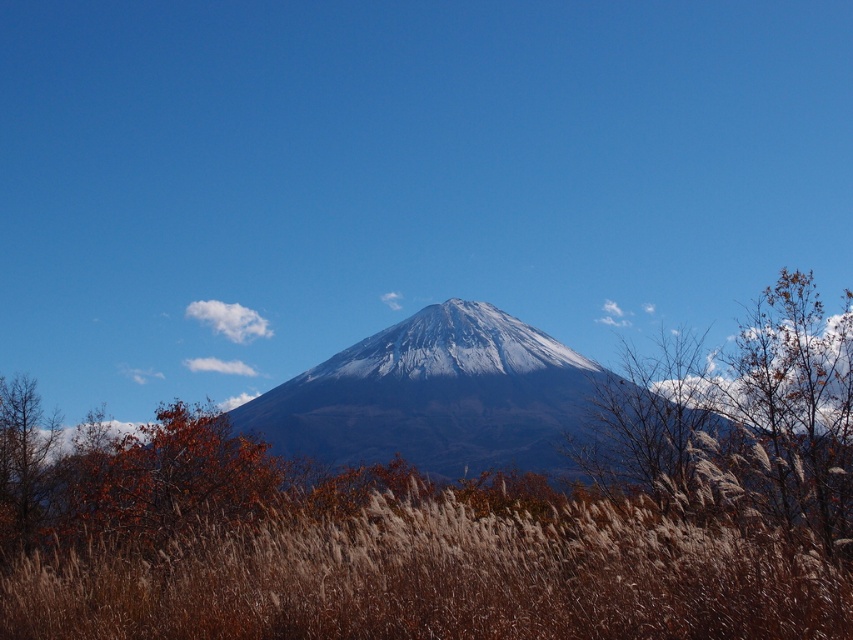
Where is `brown grass at center`? brown grass at center is located at coordinates (433, 572).

Does point (93, 582) lie behind point (178, 401)?

No, (93, 582) is in front of (178, 401).

Which is in front, point (747, 577) or point (161, 448)?

Positioned in front is point (747, 577).

At what (x,y) coordinates should I click in order to perform the action: click on brown grass at center. Please return your answer as a coordinate pair (x, y). This screenshot has height=640, width=853. Looking at the image, I should click on (433, 572).

Is brown grass at center shorter than snowy gray mountain at center?

Yes, brown grass at center is shorter than snowy gray mountain at center.

This screenshot has width=853, height=640. What do you see at coordinates (433, 572) in the screenshot?
I see `brown grass at center` at bounding box center [433, 572].

Who is more forward, (395,518) or (274,419)?

Point (395,518) is more forward.

Locate an element on the screen. Image resolution: width=853 pixels, height=640 pixels. brown grass at center is located at coordinates (433, 572).

Does snowy gray mountain at center have a greater height compared to brown matte tree at center?

Indeed, snowy gray mountain at center has a greater height compared to brown matte tree at center.

Consider the image. Is snowy gray mountain at center wider than brown matte tree at center?

Yes, snowy gray mountain at center is wider than brown matte tree at center.

At what (x,y) coordinates should I click in order to perform the action: click on snowy gray mountain at center. Please return your answer as a coordinate pair (x, y). This screenshot has width=853, height=640. Looking at the image, I should click on (434, 396).